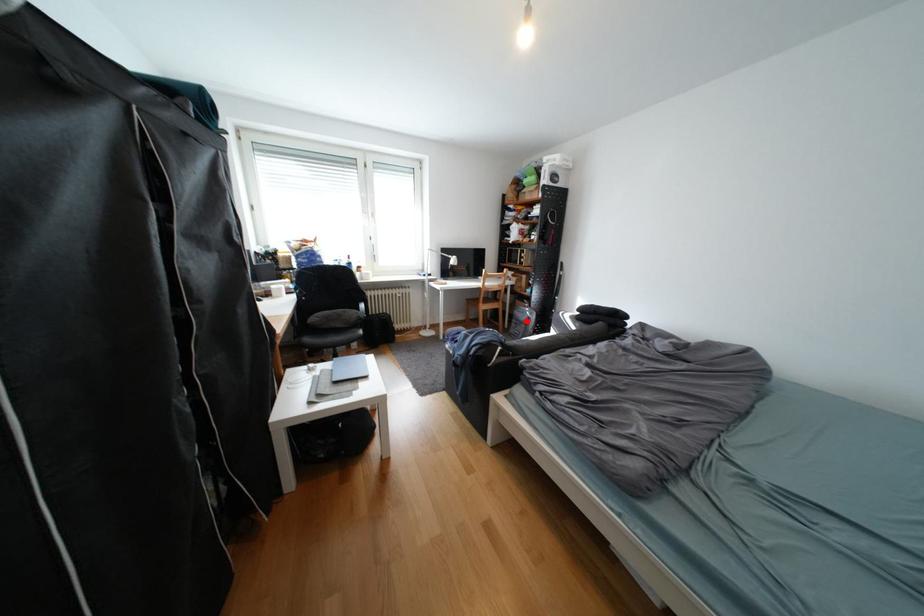
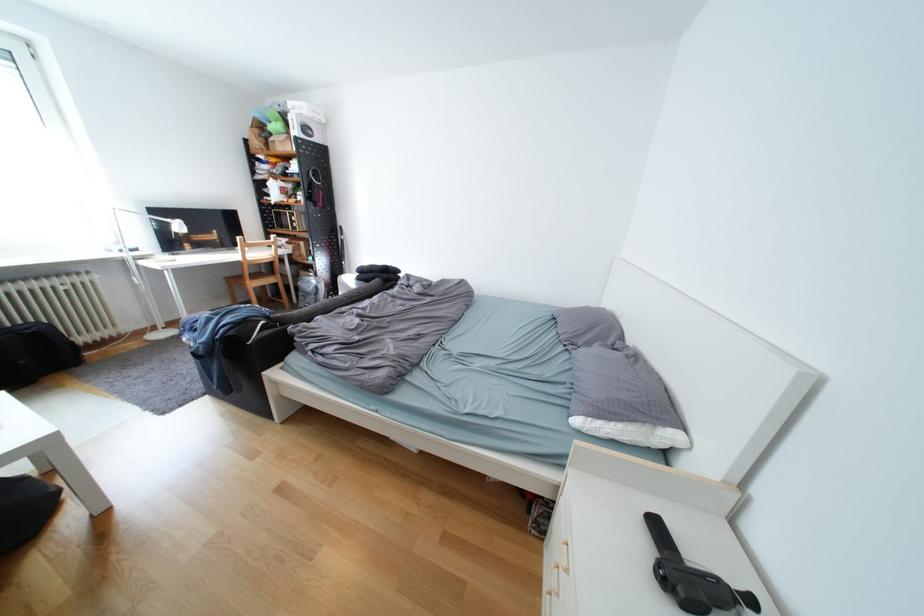
Question: I am providing you with two images of the same scene from different viewpoints. Given a red point in image1, look at the same physical point in image2. Is it:

Choices:
 (A) Closer to the viewpoint
 (B) Farther from the viewpoint

Answer: (B)